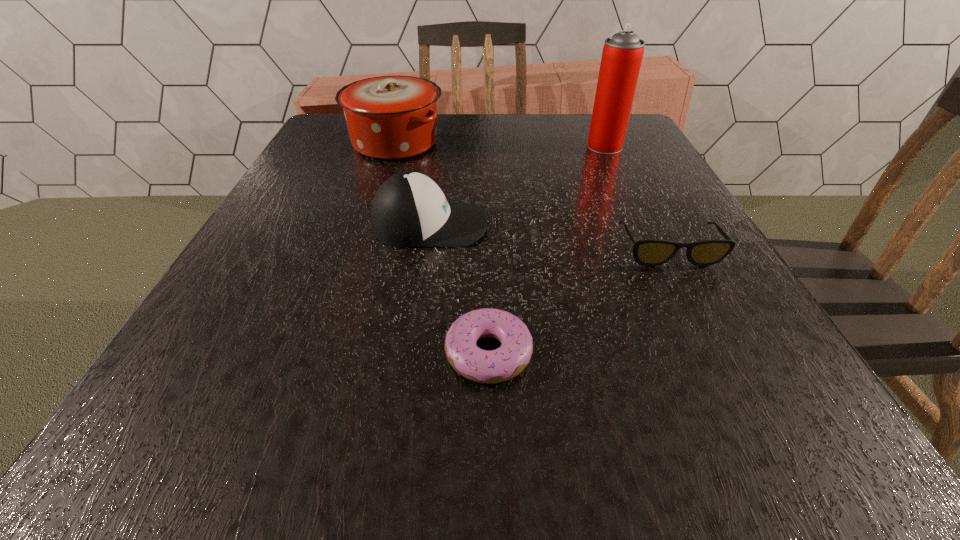
Locate an element on the screen. The width and height of the screenshot is (960, 540). blank space at the right edge of the desktop is located at coordinates (x=671, y=207).

The image size is (960, 540). In the image, there is a desktop. Identify the location of vacant space at the near left corner. (231, 436).

The image size is (960, 540). In order to click on free space at the far right corner of the desktop in this screenshot , I will do `click(640, 137)`.

The image size is (960, 540). Find the location of `empty space that is in between the sunglasses and the tallest object`. empty space that is in between the sunglasses and the tallest object is located at coordinates (636, 198).

The image size is (960, 540). I want to click on vacant point located between the shortest object and the third tallest object, so click(459, 288).

Find the location of a particular element. The image size is (960, 540). vacant point located between the second shortest object and the shortest object is located at coordinates (578, 301).

What are the coordinates of `vacant space that is in between the fourth shortest object and the fourth tallest object` in the screenshot? It's located at (532, 196).

This screenshot has width=960, height=540. I want to click on free area in between the fourth tallest object and the cap, so click(x=549, y=237).

The width and height of the screenshot is (960, 540). I want to click on free point between the aerosol can and the third tallest object, so click(517, 185).

At what (x,y) coordinates should I click in order to perform the action: click on free space that is in between the aerosol can and the casserole. Please return your answer as a coordinate pair (x, y). Image resolution: width=960 pixels, height=540 pixels. Looking at the image, I should click on (500, 145).